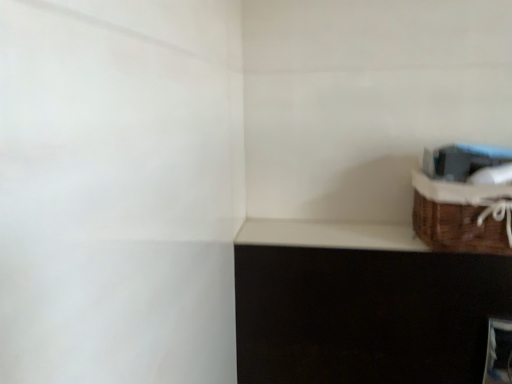
Measure the distance between white matte window sill at upper right and camera.

white matte window sill at upper right is 72.60 centimeters away from camera.

The height and width of the screenshot is (384, 512). What do you see at coordinates (376, 236) in the screenshot?
I see `white matte window sill at upper right` at bounding box center [376, 236].

Where is `white matte window sill at upper right`? white matte window sill at upper right is located at coordinates tap(376, 236).

Where is `brown woven basket at upper right`? The height and width of the screenshot is (384, 512). brown woven basket at upper right is located at coordinates (462, 216).

Describe the element at coordinates (462, 216) in the screenshot. I see `brown woven basket at upper right` at that location.

Image resolution: width=512 pixels, height=384 pixels. Find the location of `white matte window sill at upper right`. white matte window sill at upper right is located at coordinates pos(376,236).

Is white matte window sill at upper right to the right of brown woven basket at upper right from the viewer's perspective?

In fact, white matte window sill at upper right is to the left of brown woven basket at upper right.

Considering the positions of objects white matte window sill at upper right and brown woven basket at upper right in the image provided, who is in front, white matte window sill at upper right or brown woven basket at upper right?

Positioned in front is brown woven basket at upper right.

Does point (393, 232) come behind point (468, 190)?

Yes, point (393, 232) is behind point (468, 190).

From the image's perspective, which is above, white matte window sill at upper right or brown woven basket at upper right?

From the image's view, brown woven basket at upper right is above.

From a real-world perspective, is white matte window sill at upper right beneath brown woven basket at upper right?

Yes.

Considering the relative sizes of white matte window sill at upper right and brown woven basket at upper right in the image provided, is white matte window sill at upper right thinner than brown woven basket at upper right?

Indeed, white matte window sill at upper right has a lesser width compared to brown woven basket at upper right.

Is white matte window sill at upper right taller or shorter than brown woven basket at upper right?

white matte window sill at upper right is shorter than brown woven basket at upper right.

Considering the sizes of objects white matte window sill at upper right and brown woven basket at upper right in the image provided, who is bigger, white matte window sill at upper right or brown woven basket at upper right?

brown woven basket at upper right.

Is white matte window sill at upper right not within brown woven basket at upper right?

Yes, white matte window sill at upper right is outside of brown woven basket at upper right.

Would you consider white matte window sill at upper right to be distant from brown woven basket at upper right?

No, white matte window sill at upper right is not far away from brown woven basket at upper right.

Is brown woven basket at upper right at the back of white matte window sill at upper right?

No, white matte window sill at upper right is not facing the opposite direction of brown woven basket at upper right.

What's the angular difference between white matte window sill at upper right and brown woven basket at upper right's facing directions?

0.0779 degrees.

Locate an element on the screen. The width and height of the screenshot is (512, 384). basket on the right of white matte window sill at upper right is located at coordinates (462, 216).

Considering the positions of objects brown woven basket at upper right and white matte window sill at upper right in the image provided, who is more to the left, brown woven basket at upper right or white matte window sill at upper right?

Positioned to the left is white matte window sill at upper right.

Which object is closer to the camera taking this photo, brown woven basket at upper right or white matte window sill at upper right?

brown woven basket at upper right.

Considering the points (494, 242) and (312, 243), which point is in front, point (494, 242) or point (312, 243)?

The point (494, 242) is more forward.

From the image's perspective, is brown woven basket at upper right located above or below white matte window sill at upper right?

brown woven basket at upper right is situated higher than white matte window sill at upper right in the image.

From a real-world perspective, does brown woven basket at upper right sit lower than white matte window sill at upper right?

No, from a real-world perspective, brown woven basket at upper right is not beneath white matte window sill at upper right.

Considering the sizes of brown woven basket at upper right and white matte window sill at upper right in the image, is brown woven basket at upper right wider or thinner than white matte window sill at upper right?

In the image, brown woven basket at upper right appears to be wider than white matte window sill at upper right.

Considering the relative sizes of brown woven basket at upper right and white matte window sill at upper right in the image provided, is brown woven basket at upper right taller than white matte window sill at upper right?

Indeed, brown woven basket at upper right has a greater height compared to white matte window sill at upper right.

Considering the relative sizes of brown woven basket at upper right and white matte window sill at upper right in the image provided, is brown woven basket at upper right smaller than white matte window sill at upper right?

No, brown woven basket at upper right is not smaller than white matte window sill at upper right.

Is white matte window sill at upper right surrounded by brown woven basket at upper right?

No, white matte window sill at upper right is not surrounded by brown woven basket at upper right.

Are brown woven basket at upper right and white matte window sill at upper right far apart?

That's not correct — brown woven basket at upper right is a little close to white matte window sill at upper right.

Does brown woven basket at upper right turn towards white matte window sill at upper right?

Answer: No, brown woven basket at upper right does not turn towards white matte window sill at upper right.

How many degrees apart are the facing directions of brown woven basket at upper right and white matte window sill at upper right?

0.0779 degrees.

How much distance is there between brown woven basket at upper right and white matte window sill at upper right?

A distance of 9.03 centimeters exists between brown woven basket at upper right and white matte window sill at upper right.

This screenshot has width=512, height=384. What are the coordinates of `basket in front of the white matte window sill at upper right` in the screenshot? It's located at (462, 216).

In the image, there is a brown woven basket at upper right. At what (x,y) coordinates should I click in order to perform the action: click on window sill below it (from a real-world perspective). Please return your answer as a coordinate pair (x, y). This screenshot has height=384, width=512. Looking at the image, I should click on (376, 236).

Where is `window sill behind the brown woven basket at upper right`? The height and width of the screenshot is (384, 512). window sill behind the brown woven basket at upper right is located at coordinates (376, 236).